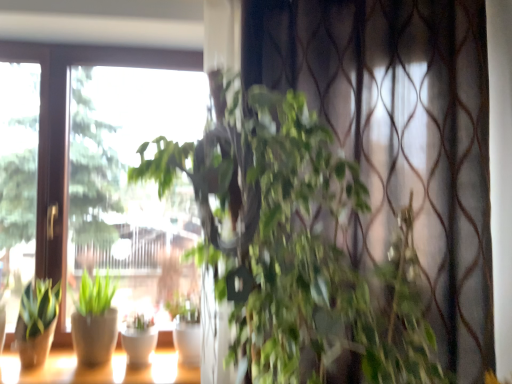
Question: Is white glossy flowerpot at center completely or partially outside of matte white pots at lower left?

Choices:
 (A) no
 (B) yes

Answer: (B)

Question: Can you confirm if white glossy flowerpot at center is shorter than matte white pots at lower left?

Choices:
 (A) yes
 (B) no

Answer: (B)

Question: Is white glossy flowerpot at center wider than matte white pots at lower left?

Choices:
 (A) no
 (B) yes

Answer: (A)

Question: Are white glossy flowerpot at center and matte white pots at lower left far apart?

Choices:
 (A) no
 (B) yes

Answer: (A)

Question: Considering the relative positions of white glossy flowerpot at center and matte white pots at lower left in the image provided, is white glossy flowerpot at center to the right of matte white pots at lower left from the viewer's perspective?

Choices:
 (A) yes
 (B) no

Answer: (A)

Question: Considering the relative positions of green leafy plant at center, the 1th houseplant when ordered from front to back, and green matte plant at lower left, arranged as the 3th houseplant when viewed from the right, in the image provided, is green leafy plant at center, the 1th houseplant when ordered from front to back, to the left or to the right of green matte plant at lower left, arranged as the 3th houseplant when viewed from the right,?

Choices:
 (A) right
 (B) left

Answer: (A)

Question: Relative to green matte plant at lower left, the 2th houseplant positioned from the front, is green leafy plant at center, the 1th houseplant when ordered from front to back, in front or behind?

Choices:
 (A) behind
 (B) front

Answer: (B)

Question: Do you think green leafy plant at center, marked as the 3th houseplant in a back-to-front arrangement, is within green matte plant at lower left, the 1th houseplant from the left, or outside of it?

Choices:
 (A) inside
 (B) outside

Answer: (B)

Question: Is green leafy plant at center, marked as the 3th houseplant in a back-to-front arrangement, wider or thinner than green matte plant at lower left, the 2th houseplant positioned from the front?

Choices:
 (A) wide
 (B) thin

Answer: (A)

Question: Is point (96, 370) closer or farther from the camera than point (41, 284)?

Choices:
 (A) farther
 (B) closer

Answer: (B)

Question: From their relative heights in the image, would you say matte white pots at lower left is taller or shorter than green matte plant at lower left, arranged as the 3th houseplant when viewed from the right?

Choices:
 (A) short
 (B) tall

Answer: (A)

Question: From the image's perspective, is matte white pots at lower left positioned above or below green matte plant at lower left, arranged as the 3th houseplant when viewed from the right?

Choices:
 (A) below
 (B) above

Answer: (A)

Question: Visually, is matte white pots at lower left positioned to the left or to the right of green matte plant at lower left, the 2th houseplant positioned from the front?

Choices:
 (A) left
 (B) right

Answer: (B)

Question: Considering the positions of point (133, 362) and point (20, 326), is point (133, 362) closer or farther from the camera than point (20, 326)?

Choices:
 (A) farther
 (B) closer

Answer: (A)

Question: Looking at their shapes, would you say white glossy flowerpot at center is wider or thinner than green matte plant at lower left, arranged as the 3th houseplant when viewed from the right?

Choices:
 (A) wide
 (B) thin

Answer: (B)